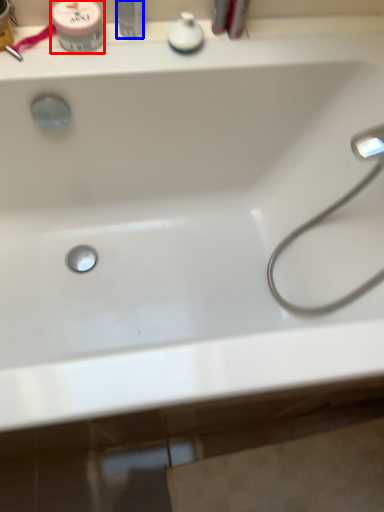
Question: Among these objects, which one is farthest to the camera, mouthwash (highlighted by a red box) or toiletry (highlighted by a blue box)?

Choices:
 (A) mouthwash
 (B) toiletry

Answer: (A)